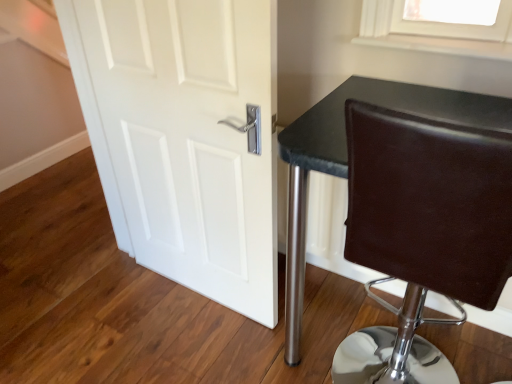
Question: Is brown leather chair at right positioned before white matte door at center?

Choices:
 (A) yes
 (B) no

Answer: (A)

Question: From a real-world perspective, is brown leather chair at right beneath white matte door at center?

Choices:
 (A) no
 (B) yes

Answer: (B)

Question: Does brown leather chair at right lie behind white matte door at center?

Choices:
 (A) no
 (B) yes

Answer: (A)

Question: Is brown leather chair at right positioned far away from white matte door at center?

Choices:
 (A) no
 (B) yes

Answer: (A)

Question: Can you confirm if brown leather chair at right is positioned to the left of white matte door at center?

Choices:
 (A) no
 (B) yes

Answer: (A)

Question: Is brown leather chair at right facing away from white matte door at center?

Choices:
 (A) no
 (B) yes

Answer: (A)

Question: From a real-world perspective, is white matte door at center on top of brown leather chair at right?

Choices:
 (A) no
 (B) yes

Answer: (B)

Question: Is brown leather chair at right at the back of white matte door at center?

Choices:
 (A) no
 (B) yes

Answer: (A)

Question: Can brown leather chair at right be found inside white matte door at center?

Choices:
 (A) yes
 (B) no

Answer: (B)

Question: Considering the relative sizes of white matte door at center and brown leather chair at right in the image provided, is white matte door at center thinner than brown leather chair at right?

Choices:
 (A) no
 (B) yes

Answer: (B)

Question: Could you tell me if white matte door at center is turned towards brown leather chair at right?

Choices:
 (A) no
 (B) yes

Answer: (A)

Question: From the image's perspective, is white matte door at center below brown leather chair at right?

Choices:
 (A) no
 (B) yes

Answer: (A)

Question: From a real-world perspective, is brown leather chair at right above or below white matte door at center?

Choices:
 (A) above
 (B) below

Answer: (B)